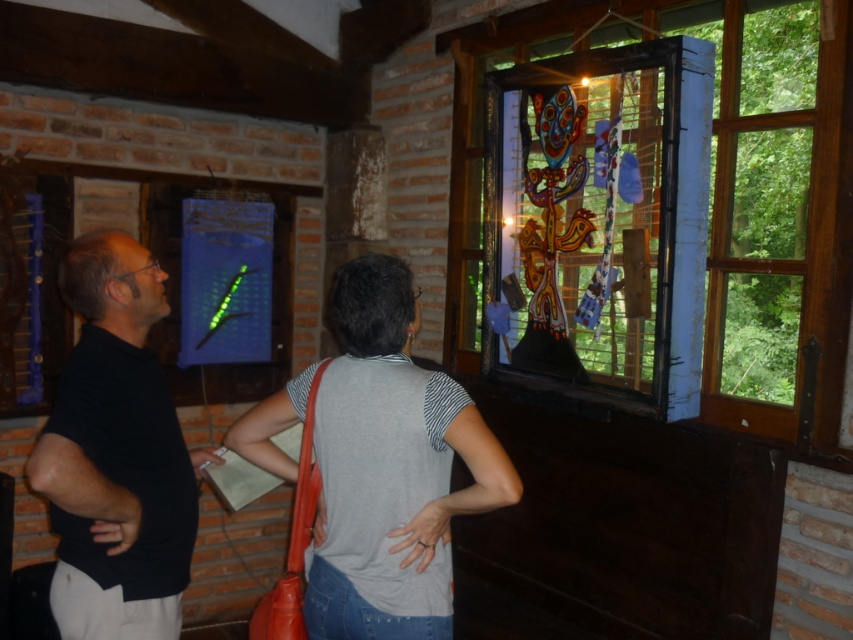
Measure the distance from stained glass window at upper right to black matte shirt at left.

Result: A distance of 4.50 feet exists between stained glass window at upper right and black matte shirt at left.

Does stained glass window at upper right have a greater height compared to black matte shirt at left?

Yes.

The width and height of the screenshot is (853, 640). I want to click on stained glass window at upper right, so click(660, 209).

This screenshot has height=640, width=853. Find the location of `stained glass window at upper right`. stained glass window at upper right is located at coordinates (660, 209).

Does gray cotton shirt at center appear on the right side of black matte shirt at left?

Indeed, gray cotton shirt at center is positioned on the right side of black matte shirt at left.

Does gray cotton shirt at center have a lesser width compared to black matte shirt at left?

In fact, gray cotton shirt at center might be wider than black matte shirt at left.

What do you see at coordinates (392, 468) in the screenshot? I see `gray cotton shirt at center` at bounding box center [392, 468].

Where is `gray cotton shirt at center`? This screenshot has height=640, width=853. gray cotton shirt at center is located at coordinates (392, 468).

Is stained glass window at upper right further to camera compared to gray cotton shirt at center?

Yes, it is.

Does stained glass window at upper right appear under gray cotton shirt at center?

No.

Locate an element on the screen. This screenshot has height=640, width=853. stained glass window at upper right is located at coordinates pyautogui.click(x=660, y=209).